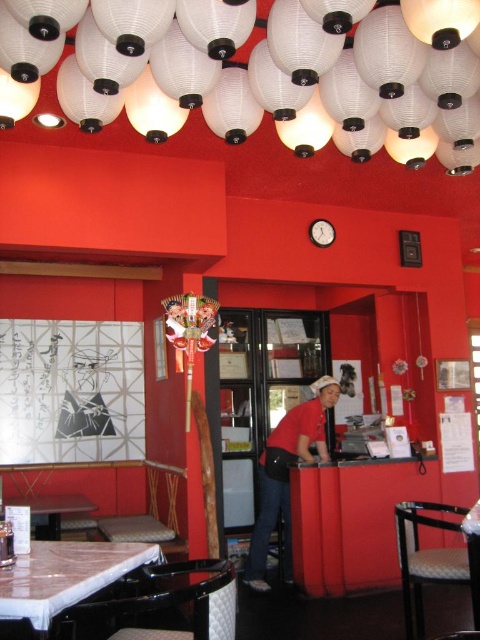
You are a server in the restaurant and need to place a 1.2 meter tall cake stand on one of the tables. Which table, the white marble table at lower left or the marble top table at center, can accommodate the cake stand without it touching the ceiling lanterns?

The marble top table at center can accommodate the cake stand because it is taller than the white marble table at lower left, providing enough vertical space to prevent the cake stand from touching the ceiling lanterns.

You are standing at the entrance of the restaurant and want to sit at the white marble table at lower left. Based on the coordinates provided, in which direction should you walk to reach it?

The white marble table at lower left is located at coordinates point (66, 576), so you should walk towards the lower left direction to reach it.